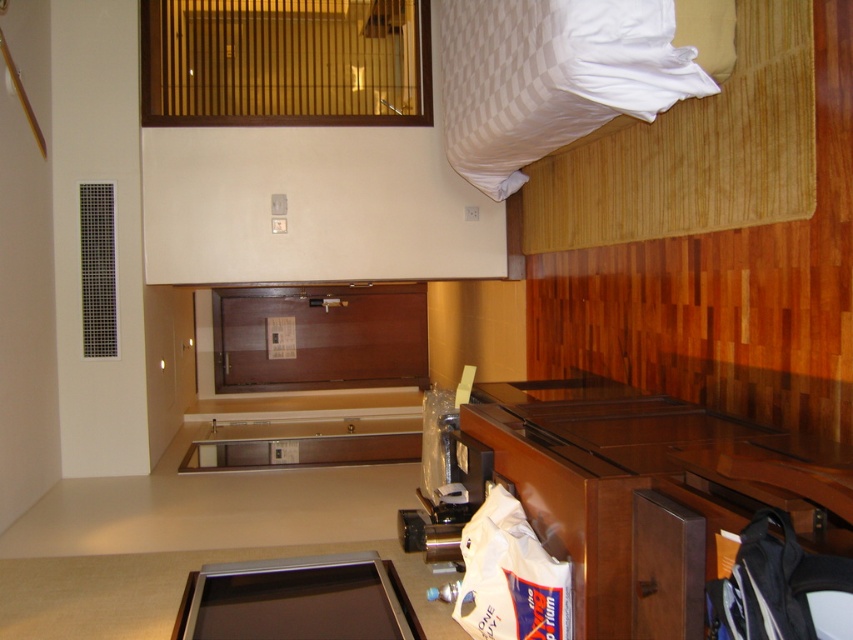
You are trying to decide whether to place a decorative item on the white striped pillow at upper right or the metallic flat panel at lower center. Which surface has a larger width?

The white striped pillow at upper right has a larger width than the metallic flat panel at lower center.